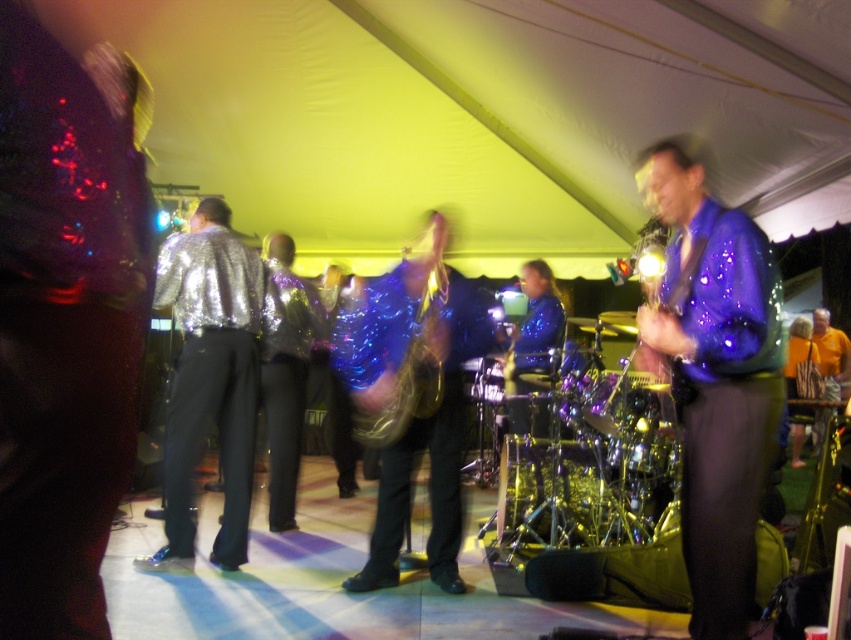
Question: Is shiny silver jacket at left closer to the viewer compared to shiny metallic drum at center?

Choices:
 (A) no
 (B) yes

Answer: (B)

Question: Based on their relative distances, which object is nearer to the shiny purple jacket at right?

Choices:
 (A) shiny silver jacket at left
 (B) shiny metallic drum at center

Answer: (B)

Question: Which object is closer to the camera taking this photo?

Choices:
 (A) shiny metallic drum at center
 (B) shiny purple jacket at right
 (C) shiny silver jacket at left

Answer: (B)

Question: Can you confirm if shiny silver jacket at left is wider than shiny metallic drum at center?

Choices:
 (A) no
 (B) yes

Answer: (B)

Question: Which object appears farthest from the camera in this image?

Choices:
 (A) shiny silver jacket at left
 (B) shiny purple jacket at right

Answer: (A)

Question: Is the position of shiny silver jacket at left more distant than that of shiny metallic drum at center?

Choices:
 (A) no
 (B) yes

Answer: (A)